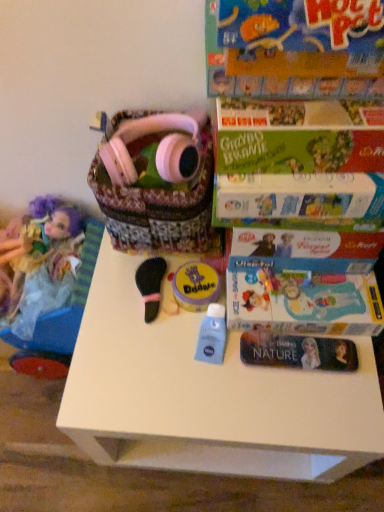
Identify the location of free space above matte cardboard book at upper right, the 1th paperback book in the back-to-front sequence (from a real-world perspective). This screenshot has width=384, height=512. point(304,282).